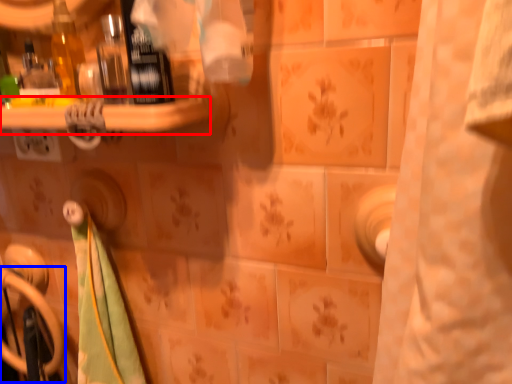
Question: Which point is further to the camera, ledge (highlighted by a red box) or door handle (highlighted by a blue box)?

Choices:
 (A) ledge
 (B) door handle

Answer: (B)